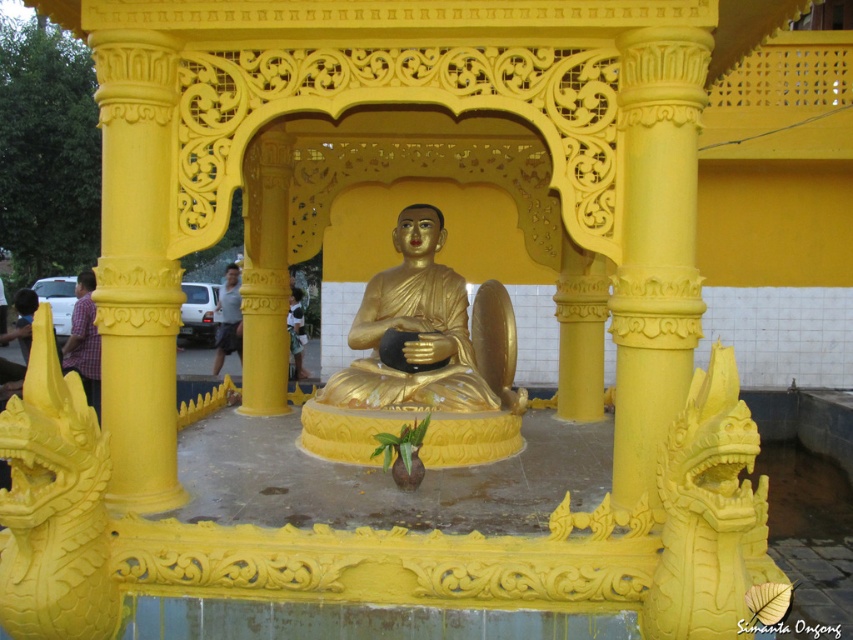
Question: Is gold polished statue at center in front of matte gray shirt at center?

Choices:
 (A) no
 (B) yes

Answer: (B)

Question: Which point is farther to the camera?

Choices:
 (A) (700, 316)
 (B) (84, 298)
 (C) (228, 316)

Answer: (C)

Question: Can you confirm if matte yellow column at center is positioned above plaid shirt at left?

Choices:
 (A) no
 (B) yes

Answer: (A)

Question: Which of the following is the farthest from the observer?

Choices:
 (A) matte gray shirt at center
 (B) plaid shirt at left
 (C) matte yellow column at center
 (D) gold polished statue at center

Answer: (A)

Question: From the image, what is the correct spatial relationship of plaid shirt at left in relation to matte gray shirt at center?

Choices:
 (A) below
 (B) above

Answer: (B)

Question: Which object is the farthest from the gold polished statue at center?

Choices:
 (A) matte gray shirt at center
 (B) plaid shirt at left

Answer: (A)